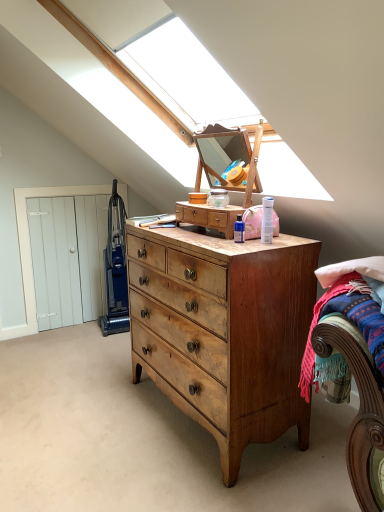
What are the coordinates of `free space to the left of light brown wood chest of drawers at center` in the screenshot? It's located at (91, 415).